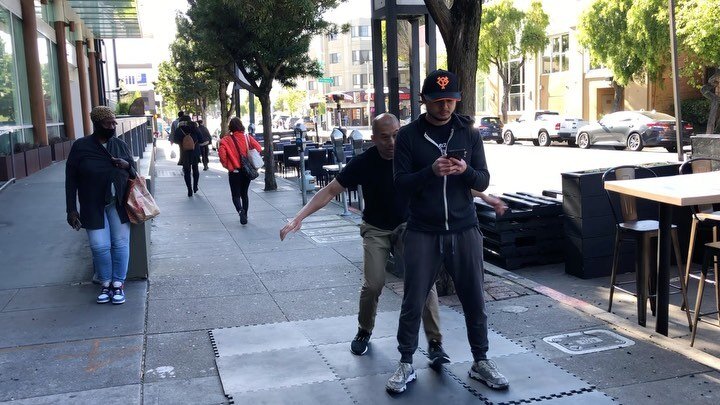
Where is `black chair`? Image resolution: width=720 pixels, height=405 pixels. black chair is located at coordinates (639, 231).